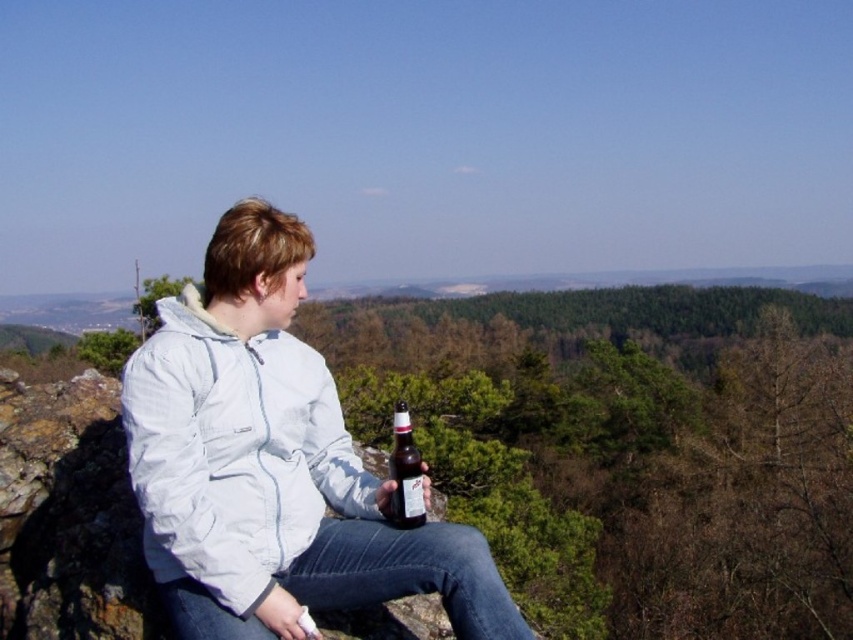
You are a photographer planning to capture the scene with the white matte jacket at center and the brown glass bottle at center. To ensure both objects are in focus, you need to know their relative sizes. Which object is narrower in width?

The white matte jacket at center is thinner than the brown glass bottle at center, so the white matte jacket at center is narrower in width.

You are a photographer trying to capture a closeup shot of both the white fleece jacket at center and the brown glass bottle at center. What is the minimum distance you need to maintain between the camera and the objects to ensure both are in frame?

The white fleece jacket at center and brown glass bottle at center are 28.36 inches apart from each other. To capture both in frame, the camera should be positioned at least 28.36 inches away from the closer object.

You are a photographer planning to capture the scene of a person sitting on a rocky outcrop. You notice two jackets, a white matte jacket at center and a white fleece jacket at center. Which jacket takes up more visual space in the photo?

The white fleece jacket at center takes up more visual space than the white matte jacket at center because it occupies more space according to the description.